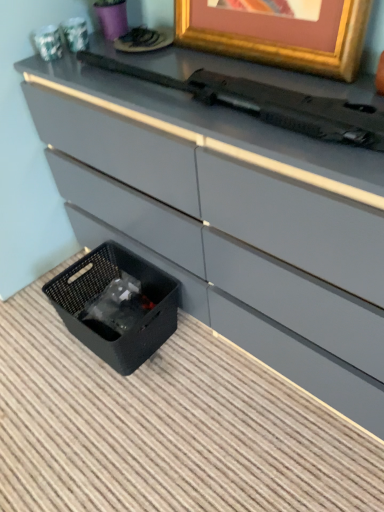
Question: Are black plastic typewriter at upper center and gold metallic picture frame at upper center far apart?

Choices:
 (A) yes
 (B) no

Answer: (B)

Question: Considering the relative positions of black plastic typewriter at upper center and gold metallic picture frame at upper center in the image provided, is black plastic typewriter at upper center to the left of gold metallic picture frame at upper center from the viewer's perspective?

Choices:
 (A) no
 (B) yes

Answer: (B)

Question: From a real-world perspective, is black plastic typewriter at upper center on top of gold metallic picture frame at upper center?

Choices:
 (A) no
 (B) yes

Answer: (A)

Question: Does black plastic typewriter at upper center lie behind gold metallic picture frame at upper center?

Choices:
 (A) no
 (B) yes

Answer: (A)

Question: From the image's perspective, is black plastic typewriter at upper center located above gold metallic picture frame at upper center?

Choices:
 (A) no
 (B) yes

Answer: (A)

Question: Is black plastic typewriter at upper center directly adjacent to gold metallic picture frame at upper center?

Choices:
 (A) yes
 (B) no

Answer: (B)

Question: Is gold metallic picture frame at upper center located outside black plastic typewriter at upper center?

Choices:
 (A) no
 (B) yes

Answer: (B)

Question: Can you confirm if gold metallic picture frame at upper center is thinner than black plastic typewriter at upper center?

Choices:
 (A) no
 (B) yes

Answer: (B)

Question: Does gold metallic picture frame at upper center have a lesser height compared to black plastic typewriter at upper center?

Choices:
 (A) no
 (B) yes

Answer: (A)

Question: Does gold metallic picture frame at upper center appear on the right side of black plastic typewriter at upper center?

Choices:
 (A) yes
 (B) no

Answer: (A)

Question: Does gold metallic picture frame at upper center have a greater height compared to black plastic typewriter at upper center?

Choices:
 (A) yes
 (B) no

Answer: (A)

Question: Is black plastic typewriter at upper center located within gold metallic picture frame at upper center?

Choices:
 (A) no
 (B) yes

Answer: (A)

Question: Can you see black woven basket at lower left touching black plastic typewriter at upper center?

Choices:
 (A) no
 (B) yes

Answer: (A)